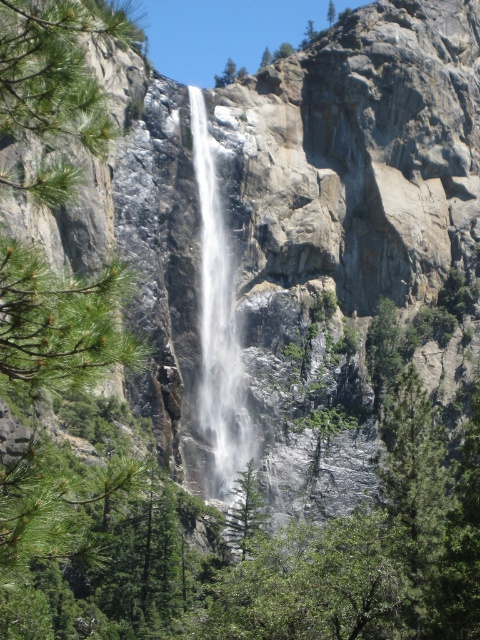
You are standing at the base of the waterfall and want to take a photo of both the white frothy water at center and the green matte tree at center. Which object should you focus on first to ensure it appears sharp in your photo?

You should focus on the white frothy water at center first because it is closer to you than the green matte tree at center, so focusing on the closer object ensures it will be sharp.

You are standing at the edge of the cliff overlooking the waterfall. You see the white frothy water at center and the green matte tree at center. Which object is positioned to the left from your viewpoint?

The white frothy water at center is to the left of the green matte tree at center from your viewpoint.